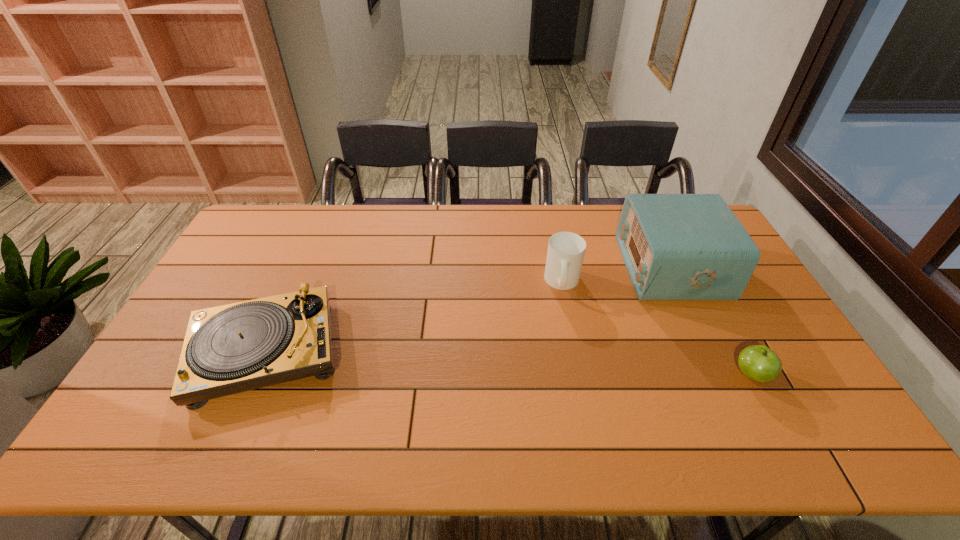
Image resolution: width=960 pixels, height=540 pixels. In order to click on object that is the closest one to the apple in this screenshot , I will do `click(675, 246)`.

Locate which object is the third closest to the mug. Please provide its 2D coordinates. Your answer should be formatted as a tuple, i.e. [(x, y)], where the tuple contains the x and y coordinates of a point satisfying the conditions above.

[(229, 349)]

Identify the location of free point that satisfies the following two spatial constraints: 1. on the front panel of the apple; 2. on the right side of the tallest object. This screenshot has width=960, height=540. (721, 375).

The width and height of the screenshot is (960, 540). I want to click on vacant space that satisfies the following two spatial constraints: 1. on the front panel of the tallest object; 2. on the handle side of the second object from left to right, so click(677, 282).

Locate an element on the screen. Image resolution: width=960 pixels, height=540 pixels. free space that satisfies the following two spatial constraints: 1. on the front panel of the tallest object; 2. on the back side of the apple is located at coordinates (721, 375).

You are a GUI agent. You are given a task and a screenshot of the screen. Output one action in this format:
    pyautogui.click(x=<x>, y=<y>)
    Task: Click on the free region that satisfies the following two spatial constraints: 1. on the front panel of the apple; 2. on the right side of the radio receiver
    This screenshot has height=540, width=960.
    Given the screenshot: What is the action you would take?
    pyautogui.click(x=721, y=375)

Locate an element on the screen. vacant space that satisfies the following two spatial constraints: 1. on the handle side of the apple; 2. on the right side of the second tallest object is located at coordinates (581, 375).